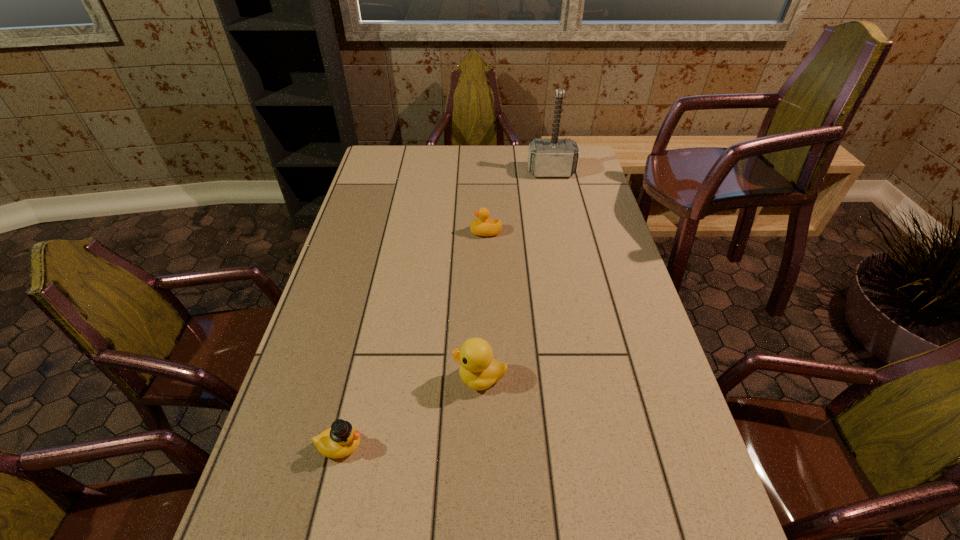
Identify the location of vacant space situated 0.390m on the face of the second nearest object. (295, 377).

Find the location of a particular element. The image size is (960, 540). free space located on the face of the farthest duck is located at coordinates pos(414,232).

You are a GUI agent. You are given a task and a screenshot of the screen. Output one action in this format:
    pyautogui.click(x=<x>, y=<y>)
    Task: Click on the vacant region located 0.100m on the face of the farthest duck
    This screenshot has height=540, width=960.
    Given the screenshot: What is the action you would take?
    pyautogui.click(x=441, y=232)

At what (x,y) coordinates should I click in order to perform the action: click on vacant position located on the face of the farthest duck. Please return your answer as a coordinate pair (x, y). The height and width of the screenshot is (540, 960). Looking at the image, I should click on (376, 232).

The width and height of the screenshot is (960, 540). Identify the location of free space located 0.070m on the front-facing side of the leftmost object. (396, 446).

The width and height of the screenshot is (960, 540). What are the coordinates of `object located at the far edge` in the screenshot? It's located at (554, 157).

The image size is (960, 540). Identify the location of object at the left edge. (340, 440).

Where is `object present at the right edge`? object present at the right edge is located at coordinates (554, 157).

Locate an element on the screen. object that is positioned at the far right corner is located at coordinates (554, 157).

Locate an element on the screen. free space at the far edge of the desktop is located at coordinates (508, 152).